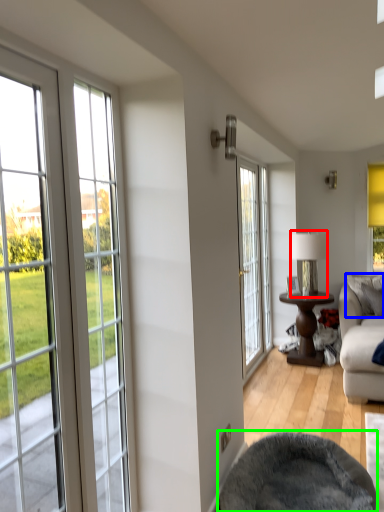
Question: Considering the real-world distances, which object is closest to lamp (highlighted by a red box)? pillow (highlighted by a blue box) or bean bag chair (highlighted by a green box).

Choices:
 (A) pillow
 (B) bean bag chair

Answer: (A)